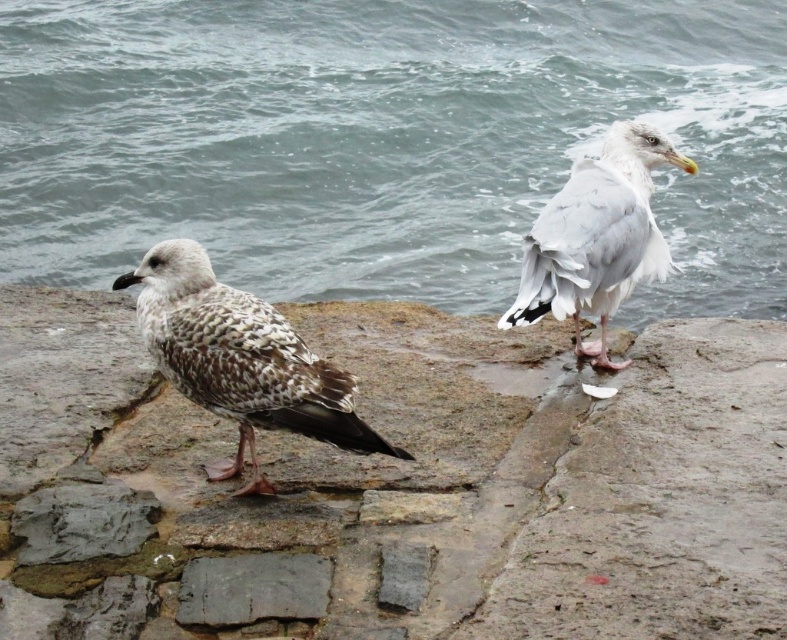
Question: Does rough stone at center appear under speckled feathered seagull at left?

Choices:
 (A) yes
 (B) no

Answer: (A)

Question: Estimate the real-world distances between objects in this image. Which object is farther from the gray water at center?

Choices:
 (A) speckled feathered seagull at left
 (B) rough stone at center
 (C) smooth gray stone at center
 (D) white feathered bird at upper right

Answer: (C)

Question: Among these points, which one is nearest to the camera?

Choices:
 (A) (154, 307)
 (B) (416, 426)
 (C) (722, 250)
 (D) (316, 579)

Answer: (D)

Question: Is rough stone at center to the right of smooth gray stone at center from the viewer's perspective?

Choices:
 (A) no
 (B) yes

Answer: (B)

Question: Which point is farther to the camera?

Choices:
 (A) speckled feathered seagull at left
 (B) smooth gray stone at center

Answer: (A)

Question: Can you confirm if gray water at center is thinner than speckled feathered seagull at left?

Choices:
 (A) no
 (B) yes

Answer: (A)